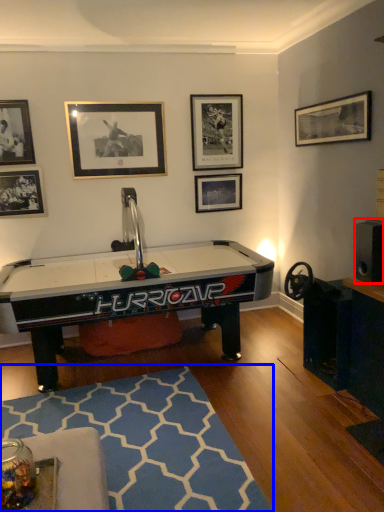
Question: Among these objects, which one is nearest to the camera, speaker (highlighted by a red box) or mat (highlighted by a blue box)?

Choices:
 (A) speaker
 (B) mat

Answer: (B)